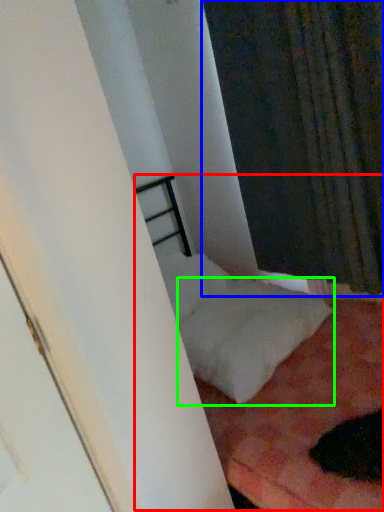
Question: Which object is positioned closest to bed (highlighted by a red box)? Select from curtain (highlighted by a blue box) and pillow (highlighted by a green box).

Choices:
 (A) curtain
 (B) pillow

Answer: (A)